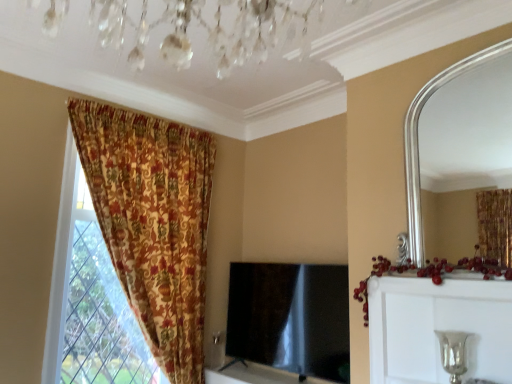
Question: Is the depth of black glossy tv at center less than that of silver metallic candle holder at lower right?

Choices:
 (A) yes
 (B) no

Answer: (B)

Question: From the image's perspective, would you say black glossy tv at center is positioned over silver metallic candle holder at lower right?

Choices:
 (A) no
 (B) yes

Answer: (A)

Question: Can you confirm if black glossy tv at center is bigger than silver metallic candle holder at lower right?

Choices:
 (A) no
 (B) yes

Answer: (B)

Question: Is there a large distance between black glossy tv at center and silver metallic candle holder at lower right?

Choices:
 (A) no
 (B) yes

Answer: (B)

Question: Is black glossy tv at center beside silver metallic candle holder at lower right?

Choices:
 (A) no
 (B) yes

Answer: (A)

Question: Looking at the image, does black glossy tv at center seem bigger or smaller compared to floral fabric curtain at left?

Choices:
 (A) small
 (B) big

Answer: (A)

Question: In the image, is black glossy tv at center positioned in front of or behind floral fabric curtain at left?

Choices:
 (A) behind
 (B) front

Answer: (A)

Question: From a real-world perspective, is black glossy tv at center above or below floral fabric curtain at left?

Choices:
 (A) above
 (B) below

Answer: (B)

Question: Is black glossy tv at center to the left or to the right of floral fabric curtain at left in the image?

Choices:
 (A) left
 (B) right

Answer: (B)

Question: From the image's perspective, relative to silver/metallic mirror at upper right, is silver metallic vase at upper right above or below?

Choices:
 (A) above
 (B) below

Answer: (B)

Question: From a real-world perspective, is silver metallic vase at upper right above or below silver/metallic mirror at upper right?

Choices:
 (A) above
 (B) below

Answer: (B)

Question: Visually, is silver metallic vase at upper right positioned to the left or to the right of silver/metallic mirror at upper right?

Choices:
 (A) left
 (B) right

Answer: (A)

Question: In terms of width, does silver metallic vase at upper right look wider or thinner when compared to silver/metallic mirror at upper right?

Choices:
 (A) thin
 (B) wide

Answer: (B)

Question: From the image's perspective, is silver/metallic mirror at upper right positioned above or below black glossy tv at center?

Choices:
 (A) above
 (B) below

Answer: (A)

Question: From a real-world perspective, relative to black glossy tv at center, is silver/metallic mirror at upper right vertically above or below?

Choices:
 (A) above
 (B) below

Answer: (A)